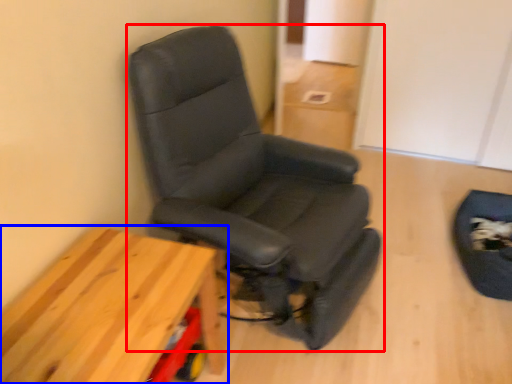
Question: Which object is further to the camera taking this photo, chair (highlighted by a red box) or table (highlighted by a blue box)?

Choices:
 (A) chair
 (B) table

Answer: (A)